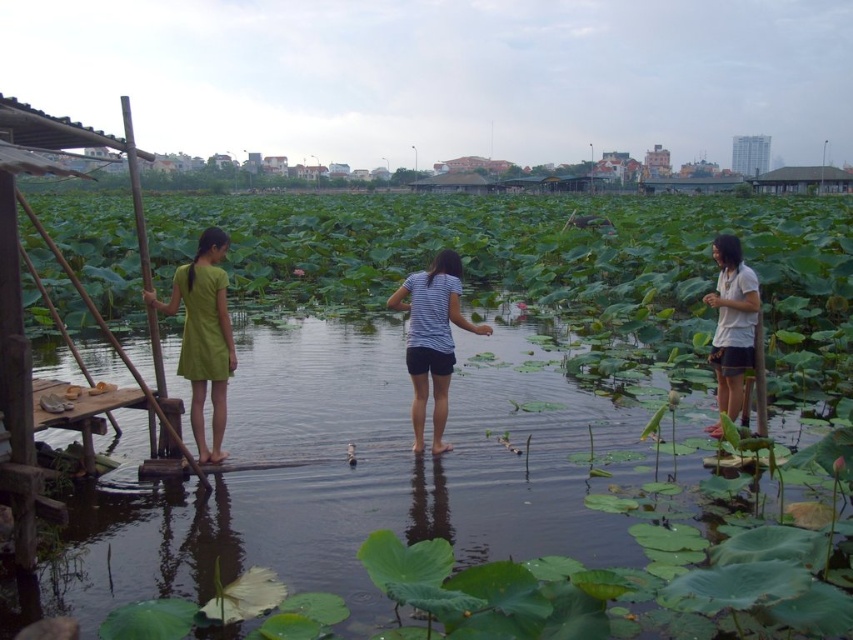
Is point (305, 400) less distant than point (421, 273)?

That is False.

Does point (125, 611) lie behind point (450, 320)?

No, (125, 611) is in front of (450, 320).

Between point (624, 548) and point (430, 372), which one is positioned behind?

The point (430, 372) is more distant.

In order to click on green leafy water at center in this screenshot , I will do pyautogui.click(x=462, y=524).

Can you confirm if green leafy water at center is shorter than green matte dress at left?

Correct, green leafy water at center is not as tall as green matte dress at left.

Is green leafy water at center below green matte dress at left?

Yes, green leafy water at center is below green matte dress at left.

Between point (167, 621) and point (184, 362), which one is positioned in front?

Point (167, 621) is in front.

Image resolution: width=853 pixels, height=640 pixels. In order to click on green leafy water at center in this screenshot , I will do `click(462, 524)`.

Who is more forward, (424, 296) or (703, 298)?

Point (424, 296) is more forward.

Does striped cotton shirt at center have a larger size compared to white cotton shirt at right?

Yes.

Identify the location of striped cotton shirt at center. The height and width of the screenshot is (640, 853). (432, 339).